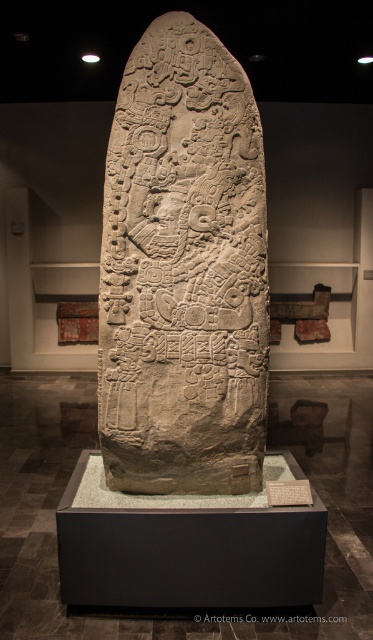
Which is in front, point (258, 445) or point (264, 608)?

Point (264, 608) is more forward.

Measure the distance from carved stone stele at center to white stone tablet at center.

carved stone stele at center and white stone tablet at center are 4.13 feet apart from each other.

Is point (236, 451) more distant than point (211, 614)?

Yes, it is.

At what (x,y) coordinates should I click in order to perform the action: click on carved stone stele at center. Please return your answer as a coordinate pair (x, y). Looking at the image, I should click on (183, 272).